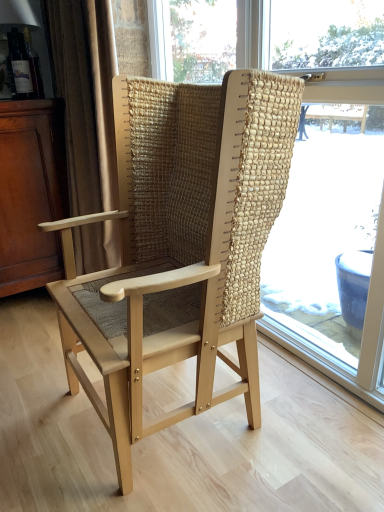
Question: Can you confirm if beige fabric curtain at left is taller than natural woven fabric chair at center?

Choices:
 (A) yes
 (B) no

Answer: (B)

Question: Is beige fabric curtain at left shorter than natural woven fabric chair at center?

Choices:
 (A) yes
 (B) no

Answer: (A)

Question: Is beige fabric curtain at left bigger than natural woven fabric chair at center?

Choices:
 (A) yes
 (B) no

Answer: (B)

Question: From a real-world perspective, is beige fabric curtain at left over natural woven fabric chair at center?

Choices:
 (A) no
 (B) yes

Answer: (B)

Question: Does beige fabric curtain at left come in front of natural woven fabric chair at center?

Choices:
 (A) yes
 (B) no

Answer: (B)

Question: Does beige fabric curtain at left have a greater width compared to natural woven fabric chair at center?

Choices:
 (A) no
 (B) yes

Answer: (B)

Question: From the image's perspective, is natural wood chair at center located beneath natural woven fabric chair at center?

Choices:
 (A) no
 (B) yes

Answer: (B)

Question: Considering the relative positions of natural wood chair at center and natural woven fabric chair at center in the image provided, is natural wood chair at center behind natural woven fabric chair at center?

Choices:
 (A) no
 (B) yes

Answer: (A)

Question: Is natural wood chair at center bigger than natural woven fabric chair at center?

Choices:
 (A) yes
 (B) no

Answer: (A)

Question: Is natural wood chair at center facing away from natural woven fabric chair at center?

Choices:
 (A) no
 (B) yes

Answer: (B)

Question: Is natural wood chair at center smaller than natural woven fabric chair at center?

Choices:
 (A) no
 (B) yes

Answer: (A)

Question: Is natural wood chair at center at the left side of natural woven fabric chair at center?

Choices:
 (A) yes
 (B) no

Answer: (A)

Question: Is the depth of mahogany wood dresser at left greater than that of natural woven fabric chair at center?

Choices:
 (A) no
 (B) yes

Answer: (B)